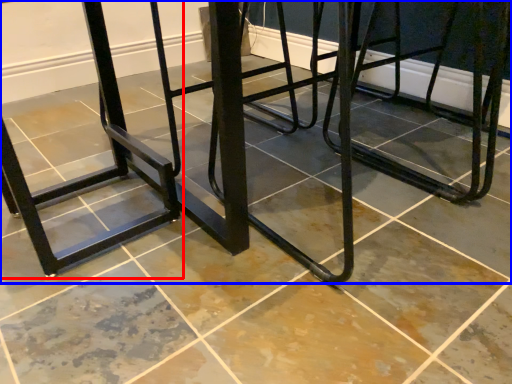
Question: Which object is closer to the camera taking this photo, bar stool (highlighted by a red box) or furniture (highlighted by a blue box)?

Choices:
 (A) bar stool
 (B) furniture

Answer: (B)